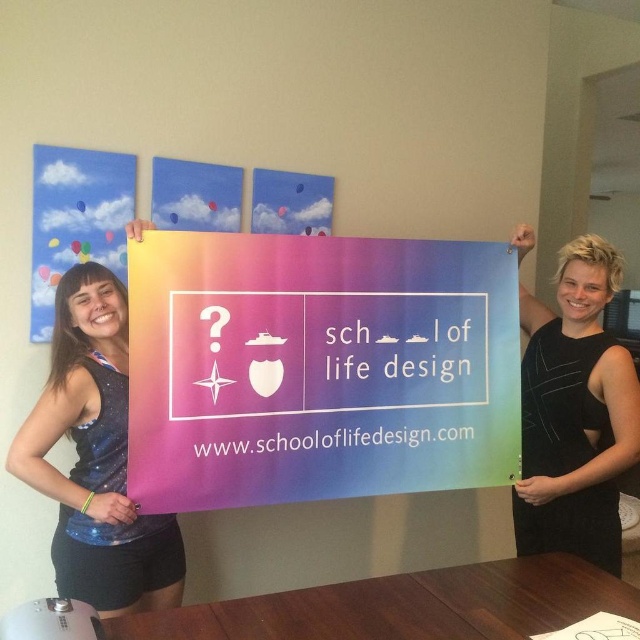
In the scene shown: You are trying to hang the rainbow gradient poster at center and the glossy fabric tank top at left on a wall. The wall has a width of 1.5 meters. Can both items fit side by side without overlapping?

The rainbow gradient poster at center might be wider than glossy fabric tank top at left, so it is uncertain if both can fit side by side on the 1.5 meters wide wall without overlapping. Check their exact widths first.

You are at a career fair and see two people holding a promotional sign for the School of Life Design. They are wearing a glossy fabric tank top at left and a black matte dress at right. Which clothing item is positioned to the left?

The glossy fabric tank top at left is positioned to the left of the black matte dress at right.